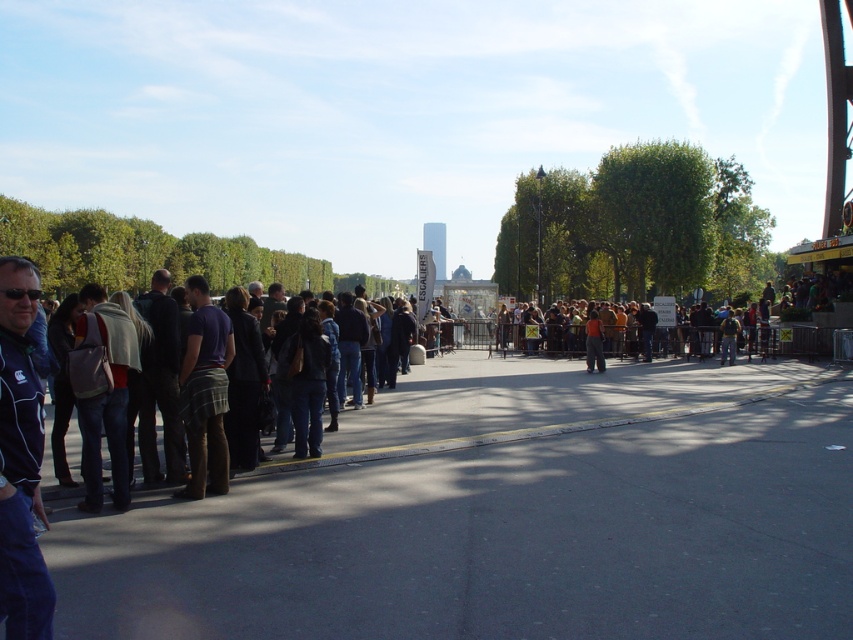
Question: Is plaid fabric pants at center positioned before orange cotton shirt at center?

Choices:
 (A) no
 (B) yes

Answer: (B)

Question: Which point is farther to the camera?

Choices:
 (A) (3, 397)
 (B) (589, 310)
 (C) (189, 497)
 (D) (727, 332)

Answer: (D)

Question: Which of the following is the farthest from the observer?

Choices:
 (A) (218, 387)
 (B) (735, 324)
 (C) (585, 323)
 (D) (33, 307)

Answer: (C)

Question: Which point appears farthest from the camera in this image?

Choices:
 (A) (45, 628)
 (B) (724, 332)
 (C) (585, 368)
 (D) (219, 442)

Answer: (B)

Question: Does plaid fabric pants at center appear under denim jacket at center?

Choices:
 (A) yes
 (B) no

Answer: (A)

Question: Can you confirm if blue fabric jacket at lower left is smaller than orange cotton shirt at center?

Choices:
 (A) no
 (B) yes

Answer: (B)